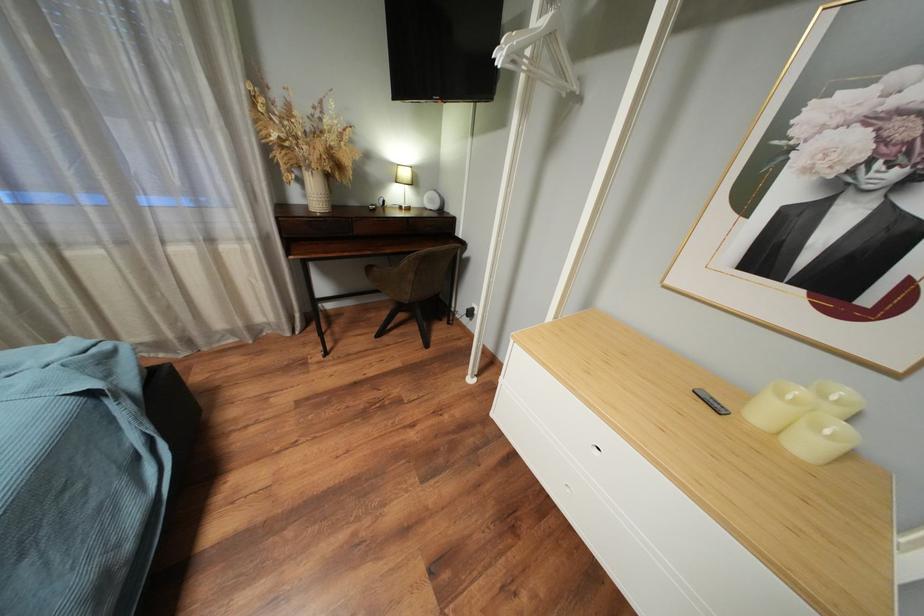
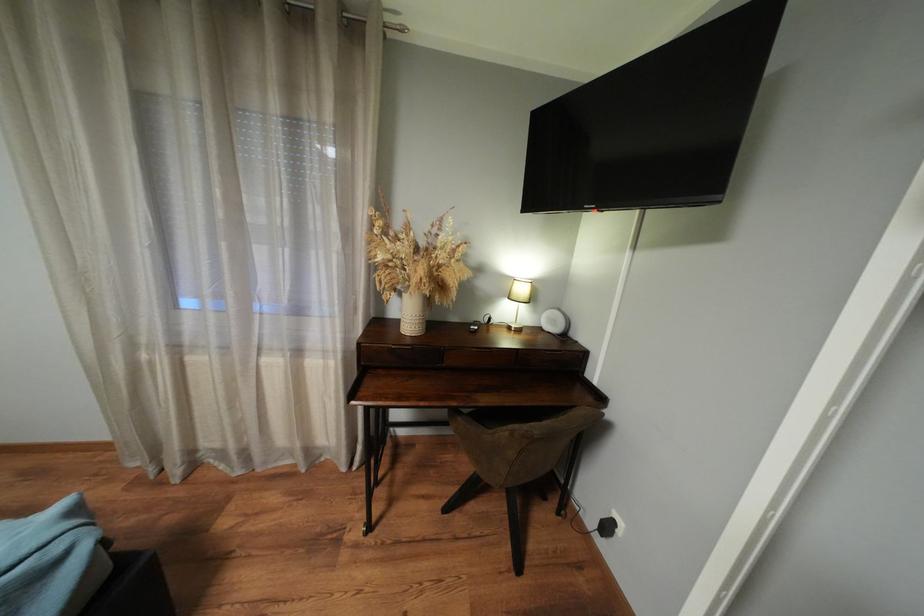
Which direction would the cameraman need to move to produce the second image?

The cameraman walked toward left, forward.